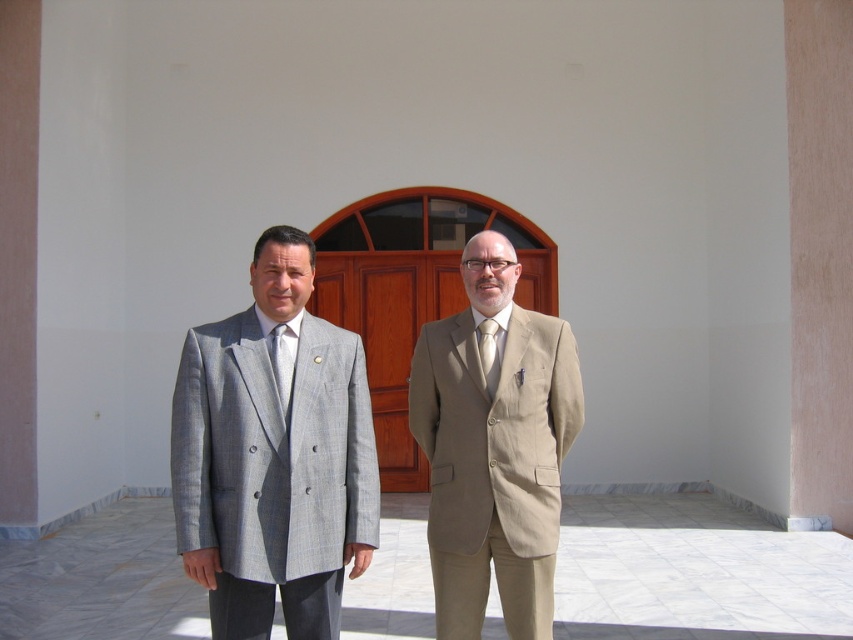
Where is the beige fabric suit at center located in the image?

The beige fabric suit at center is located at point (494,449).

You are a photographer adjusting your camera settings to focus on the two individuals in front of the wooden door. Which tie, the matte gray tie at center or the matte white tie at center, will appear larger in your camera view?

The matte gray tie at center will appear larger in the camera view because it is closer to the viewer than the matte white tie at center.

You are standing in front of the large wooden door with an arched top and see the two individuals. The point at coordinates [494,449] is located on one of their suits. Which individual is this point on?

The point at coordinates [494,449] is on the beige fabric suit at center, which belongs to the individual on the right wearing a beige suit.